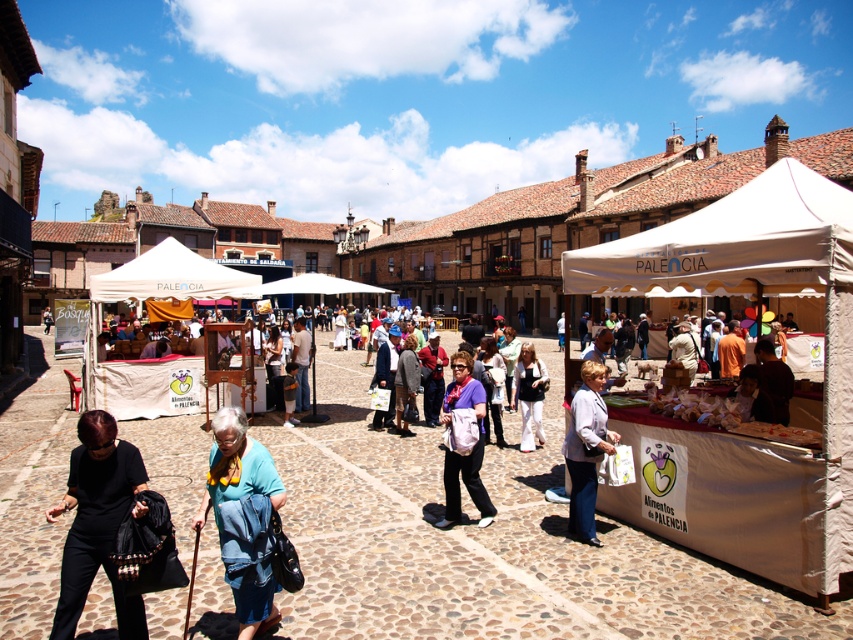
Who is positioned more to the right, black matte pants at lower left or matte white bag at center?

Positioned to the right is matte white bag at center.

Between black matte pants at lower left and matte white bag at center, which one has more height?

matte white bag at center

Is point (74, 582) positioned before point (459, 458)?

Yes, it is in front of point (459, 458).

Where is `black matte pants at lower left`? This screenshot has width=853, height=640. black matte pants at lower left is located at coordinates [97, 522].

Does white fabric canopy at center come in front of light blue fabric jacket at lower right?

No, white fabric canopy at center is behind light blue fabric jacket at lower right.

Does white fabric canopy at center have a lesser height compared to light blue fabric jacket at lower right?

No, white fabric canopy at center is not shorter than light blue fabric jacket at lower right.

Does point (221, 289) come behind point (579, 490)?

That is True.

Identify the location of white fabric canopy at center. The image size is (853, 640). (171, 276).

Between black matte pants at lower left and blue fabric at center, which one appears on the right side from the viewer's perspective?

From the viewer's perspective, blue fabric at center appears more on the right side.

You are a GUI agent. You are given a task and a screenshot of the screen. Output one action in this format:
    pyautogui.click(x=<x>, y=<y>)
    Task: Click on the black matte pants at lower left
    
    Given the screenshot: What is the action you would take?
    pyautogui.click(x=97, y=522)

Locate an element on the screen. The width and height of the screenshot is (853, 640). black matte pants at lower left is located at coordinates (97, 522).